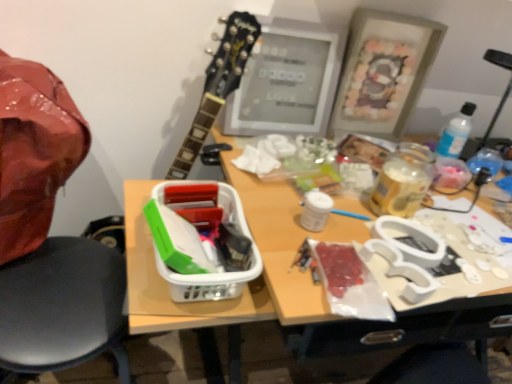
Looking at this image, measure the distance between point (x=315, y=119) and camera.

3.67 feet.

Image resolution: width=512 pixels, height=384 pixels. I want to click on black plastic chair at left, so click(62, 306).

Identify the location of matte gray frame at upper center. This screenshot has width=512, height=384. (286, 83).

Is black plastic chair at left bigger or smaller than white plastic lunch box at center?

Clearly, black plastic chair at left is larger in size than white plastic lunch box at center.

From the image's perspective, is black plastic chair at left positioned above or below white plastic lunch box at center?

→ black plastic chair at left is below white plastic lunch box at center.

Is black plastic chair at left shorter than white plastic lunch box at center?

In fact, black plastic chair at left may be taller than white plastic lunch box at center.

Considering the relative positions of black plastic chair at left and white plastic lunch box at center in the image provided, is black plastic chair at left to the right of white plastic lunch box at center from the viewer's perspective?

Incorrect, black plastic chair at left is not on the right side of white plastic lunch box at center.

The width and height of the screenshot is (512, 384). I want to click on lunch box below the wooden picture frame at upper right (from the image's perspective), so click(x=201, y=240).

From the image's perspective, which is below, wooden picture frame at upper right or white plastic lunch box at center?

white plastic lunch box at center appears lower in the image.

Between wooden picture frame at upper right and white plastic lunch box at center, which one has larger size?

wooden picture frame at upper right.

How distant is wooden picture frame at upper right from white plastic lunch box at center?

wooden picture frame at upper right and white plastic lunch box at center are 22.19 inches apart from each other.

Can you tell me how much matte gray frame at upper center and white plastic lunch box at center differ in facing direction?

0.442 degrees separate the facing orientations of matte gray frame at upper center and white plastic lunch box at center.

Is matte gray frame at upper center to the left of white plastic lunch box at center from the viewer's perspective?

No.

Between matte gray frame at upper center and white plastic lunch box at center, which one has less height?

white plastic lunch box at center is shorter.

From a real-world perspective, is matte gray frame at upper center positioned over white plastic lunch box at center based on gravity?

Yes, from a real-world perspective, matte gray frame at upper center is above white plastic lunch box at center.

Is white plastic lunch box at center in contact with wooden picture frame at upper right?

They are not placed beside each other.

Between point (186, 290) and point (409, 60), which one is positioned in front?

The point (186, 290) is in front.

Is white plastic lunch box at center positioned with its back to wooden picture frame at upper right?

No, white plastic lunch box at center's orientation is not away from wooden picture frame at upper right.

Is matte gray frame at upper center surrounding wooden picture frame at upper right?

Definitely not — wooden picture frame at upper right is not inside matte gray frame at upper center.

Between matte gray frame at upper center and wooden picture frame at upper right, which one appears on the left side from the viewer's perspective?

matte gray frame at upper center.

Image resolution: width=512 pixels, height=384 pixels. Find the location of `computer monitor on the left of wooden picture frame at upper right`. computer monitor on the left of wooden picture frame at upper right is located at coordinates tap(286, 83).

Is the depth of matte gray frame at upper center less than that of wooden picture frame at upper right?

Yes, matte gray frame at upper center is in front of wooden picture frame at upper right.

Who is taller, matte gray frame at upper center or black plastic chair at left?

black plastic chair at left.

From a real-world perspective, which object rests below the other?

black plastic chair at left is physically lower.

Is matte gray frame at upper center turned away from black plastic chair at left?

matte gray frame at upper center is not turned away from black plastic chair at left.

Considering the sizes of wooden picture frame at upper right and black plastic chair at left in the image, is wooden picture frame at upper right taller or shorter than black plastic chair at left?

wooden picture frame at upper right is shorter than black plastic chair at left.

From the picture: Which is in front, wooden picture frame at upper right or black plastic chair at left?

black plastic chair at left is in front.

Is the surface of wooden picture frame at upper right in direct contact with black plastic chair at left?

No, wooden picture frame at upper right is not with black plastic chair at left.

From the image's perspective, is wooden picture frame at upper right located above or below black plastic chair at left?

Clearly, from the image's perspective, wooden picture frame at upper right is above black plastic chair at left.

This screenshot has width=512, height=384. Identify the location of lunch box behind the black plastic chair at left. [x=201, y=240].

The image size is (512, 384). Identify the location of picture frame on the right of white plastic lunch box at center. (383, 71).

Looking at the image, which one is located closer to black plastic chair at left, wooden picture frame at upper right or matte gray frame at upper center?

matte gray frame at upper center.

When comparing their distances from matte gray frame at upper center, does white plastic lunch box at center or wooden picture frame at upper right seem further?

white plastic lunch box at center is positioned further to the anchor matte gray frame at upper center.

Looking at this image, based on their spatial positions, is wooden picture frame at upper right or white plastic lunch box at center further from matte gray frame at upper center?

white plastic lunch box at center is positioned further to the anchor matte gray frame at upper center.

Considering their positions, is wooden picture frame at upper right positioned further to white plastic lunch box at center than black plastic chair at left?

wooden picture frame at upper right lies further to white plastic lunch box at center than the other object.

From the image, which object appears to be nearer to wooden picture frame at upper right, black plastic chair at left or white plastic lunch box at center?

Among the two, white plastic lunch box at center is located nearer to wooden picture frame at upper right.

Considering their positions, is black plastic chair at left positioned closer to matte gray frame at upper center than white plastic lunch box at center?

white plastic lunch box at center is positioned closer to the anchor matte gray frame at upper center.

Estimate the real-world distances between objects in this image. Which object is further from black plastic chair at left, matte gray frame at upper center or wooden picture frame at upper right?

wooden picture frame at upper right lies further to black plastic chair at left than the other object.

From the image, which object appears to be farther from matte gray frame at upper center, white plastic lunch box at center or black plastic chair at left?

black plastic chair at left is positioned further to the anchor matte gray frame at upper center.

I want to click on lunch box between black plastic chair at left and wooden picture frame at upper right, so click(201, 240).

Find the location of a particular element. computer monitor between wooden picture frame at upper right and black plastic chair at left in the vertical direction is located at coordinates (286, 83).

Find the location of `computer monitor between wooden picture frame at upper right and white plastic lunch box at center in the vertical direction`. computer monitor between wooden picture frame at upper right and white plastic lunch box at center in the vertical direction is located at coordinates (286, 83).

The image size is (512, 384). Find the location of `lunch box between matte gray frame at upper center and black plastic chair at left in the vertical direction`. lunch box between matte gray frame at upper center and black plastic chair at left in the vertical direction is located at coordinates (201, 240).